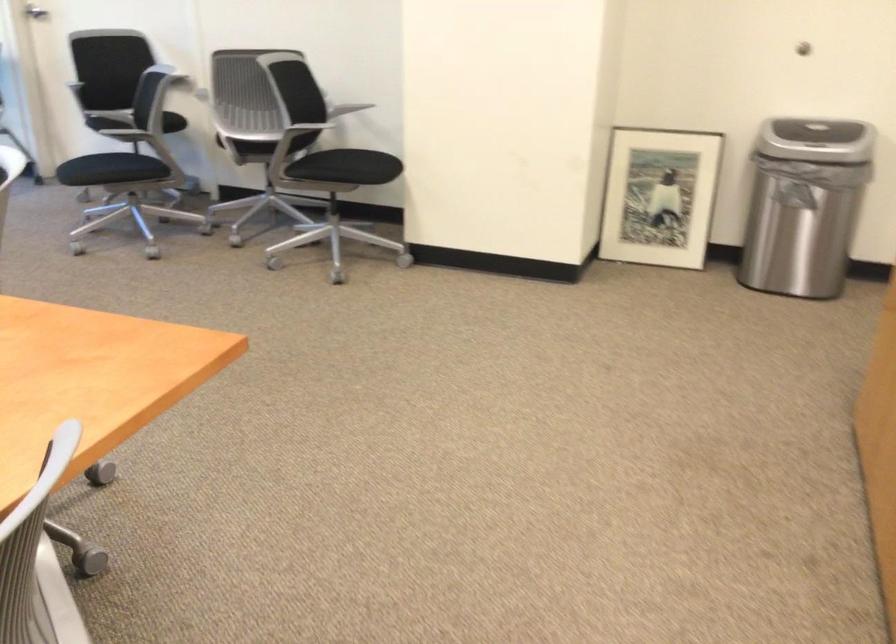
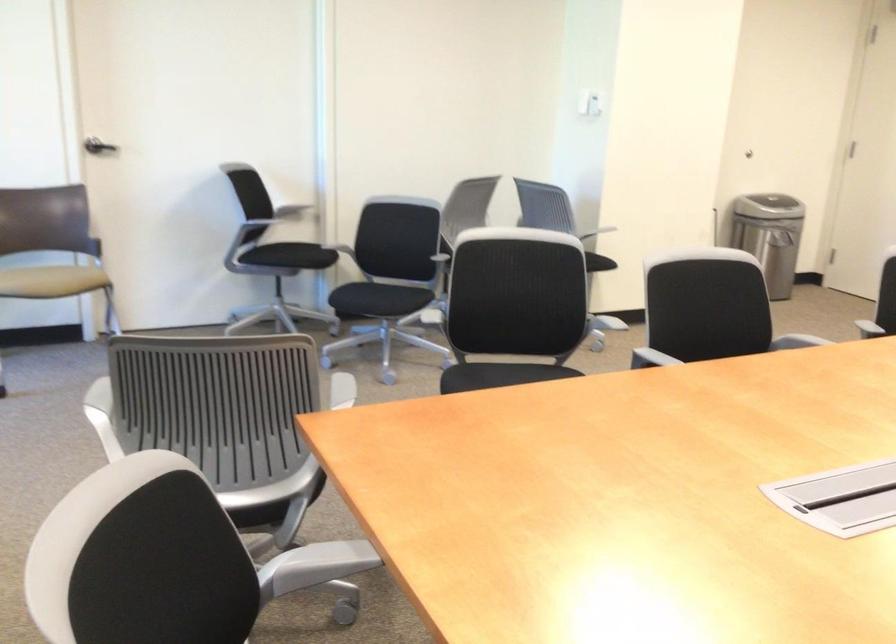
Question: I am providing you with two images of the same scene from different viewpoints. Which of the following objects are not visible in image2?

Choices:
 (A) colorful baby toy
 (B) metal chair armrest
 (C) white light switch
 (D) chair armrest

Answer: (D)